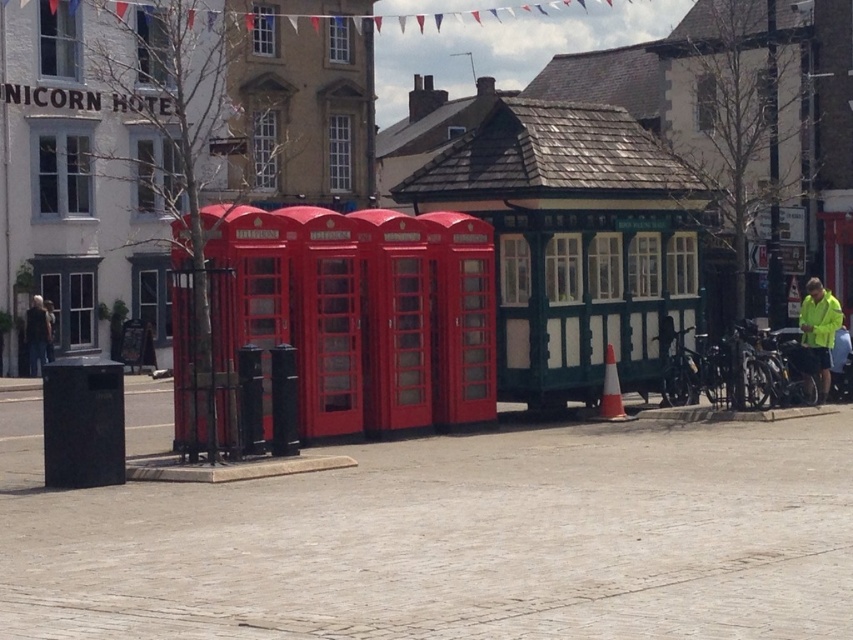
Question: Which point is closer to the camera taking this photo?

Choices:
 (A) (820, 353)
 (B) (45, 317)

Answer: (A)

Question: Is the position of neon yellow jacket at right less distant than that of dark gray jacket at left?

Choices:
 (A) yes
 (B) no

Answer: (A)

Question: Does neon yellow jacket at right have a greater width compared to dark gray jacket at left?

Choices:
 (A) yes
 (B) no

Answer: (A)

Question: Which point appears closest to the camera in this image?

Choices:
 (A) (30, 308)
 (B) (827, 362)

Answer: (B)

Question: Which point is farther to the camera?

Choices:
 (A) dark gray jacket at left
 (B) neon yellow jacket at right

Answer: (A)

Question: Does neon yellow jacket at right appear on the right side of dark gray jacket at left?

Choices:
 (A) no
 (B) yes

Answer: (B)